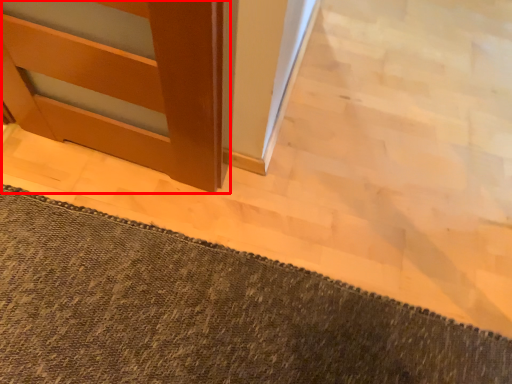
Question: From the image, what is the correct spatial relationship of door (annotated by the red box) in relation to bath mat?

Choices:
 (A) left
 (B) right

Answer: (A)